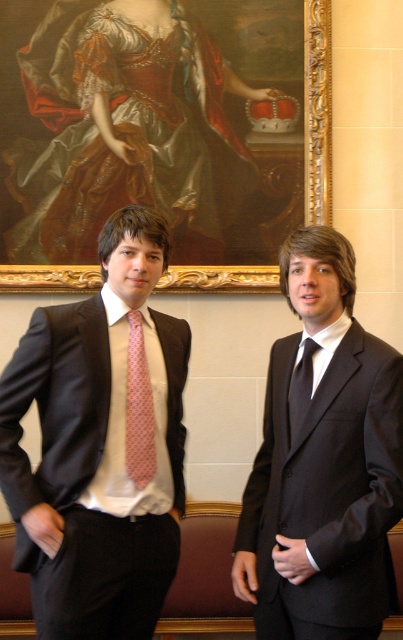
Question: Is gold ornate frame at upper center to the right of matte pink tie at center from the viewer's perspective?

Choices:
 (A) no
 (B) yes

Answer: (B)

Question: Which object appears farthest from the camera in this image?

Choices:
 (A) shiny black suit at center
 (B) matte black suit at center

Answer: (B)

Question: Which point is closer to the camera taking this photo?

Choices:
 (A) (147, 476)
 (B) (27, 513)
 (C) (66, 284)
 (D) (294, 403)

Answer: (B)

Question: Does pink dotted tie at center have a lesser width compared to matte pink tie at center?

Choices:
 (A) no
 (B) yes

Answer: (B)

Question: Which point appears closest to the camera in this image?

Choices:
 (A) (282, 492)
 (B) (126, 362)
 (C) (116, 620)
 (D) (317, 136)

Answer: (A)

Question: Does matte black suit at center come behind shiny black suit at center?

Choices:
 (A) no
 (B) yes

Answer: (B)